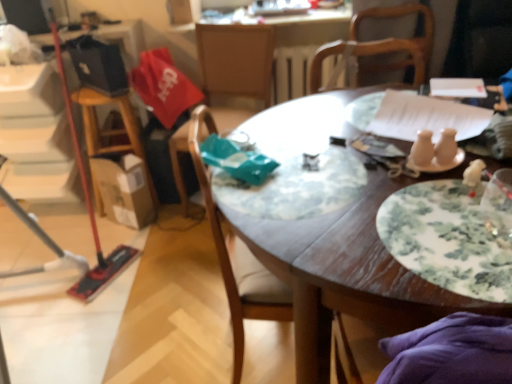
The width and height of the screenshot is (512, 384). What do you see at coordinates (447, 239) in the screenshot?
I see `floral-patterned ceramic plate at center-right` at bounding box center [447, 239].

What do you see at coordinates (234, 234) in the screenshot?
I see `wooden chair at center, the 2th chair when ordered from back to front` at bounding box center [234, 234].

What do you see at coordinates (236, 60) in the screenshot? The width and height of the screenshot is (512, 384). I see `wooden chair at center, positioned as the first chair in back-to-front order` at bounding box center [236, 60].

Image resolution: width=512 pixels, height=384 pixels. In order to click on wooden table at center in this screenshot , I will do `click(335, 272)`.

From a real-world perspective, is wooden table at center physically located above or below floral-patterned ceramic plate at center-right?

In terms of real-world spatial position, wooden table at center is below floral-patterned ceramic plate at center-right.

Between wooden table at center and floral-patterned ceramic plate at center-right, which one has more height?

wooden table at center is taller.

Is point (240, 110) closer or farther from the camera than point (294, 235)?

Clearly, point (240, 110) is more distant from the camera than point (294, 235).

From the picture: Is wooden chair at center, positioned as the first chair in back-to-front order, situated inside wooden table at center or outside?

wooden chair at center, positioned as the first chair in back-to-front order, is spatially situated outside wooden table at center.

Is wooden chair at center, positioned as the first chair in back-to-front order, bigger than wooden table at center?

Incorrect, wooden chair at center, positioned as the first chair in back-to-front order, is not larger than wooden table at center.

Between wooden chair at center, the second chair positioned from the front, and wooden table at center, which one has smaller width?

wooden chair at center, the second chair positioned from the front, is thinner.

From the image's perspective, which one is positioned higher, wooden chair at center, the second chair positioned from the front, or wooden chair at center, the 2th chair when ordered from back to front?

wooden chair at center, the second chair positioned from the front.

Find the location of a particular element. chair lying on the left of wooden chair at center, marked as the 1th chair in a front-to-back arrangement is located at coordinates (236, 60).

From a real-world perspective, does wooden chair at center, positioned as the first chair in back-to-front order, stand above wooden chair at center, marked as the 1th chair in a front-to-back arrangement?

Yes, from a real-world perspective, wooden chair at center, positioned as the first chair in back-to-front order, is over wooden chair at center, marked as the 1th chair in a front-to-back arrangement

Is wooden chair at center, the second chair positioned from the front, aimed at wooden chair at center, the 2th chair when ordered from back to front?

Yes, wooden chair at center, the second chair positioned from the front, is facing wooden chair at center, the 2th chair when ordered from back to front.

Considering the relative sizes of floral-patterned ceramic plate at center-right and wooden chair at center, positioned as the first chair in back-to-front order, in the image provided, is floral-patterned ceramic plate at center-right shorter than wooden chair at center, positioned as the first chair in back-to-front order,?

Correct, floral-patterned ceramic plate at center-right is not as tall as wooden chair at center, positioned as the first chair in back-to-front order.

Find the location of a particular element. the 2nd chair to the left of the floral-patterned ceramic plate at center-right, starting your count from the anchor is located at coordinates (236, 60).

Which point is more forward, (x=415, y=225) or (x=247, y=114)?

The point (x=415, y=225) is more forward.

Who is bigger, floral-patterned ceramic plate at center-right or wooden chair at center, positioned as the first chair in back-to-front order?

Bigger between the two is wooden chair at center, positioned as the first chair in back-to-front order.

Is wooden chair at center, the 2th chair when ordered from back to front, facing towards floral-patterned ceramic plate at center-right?

No, wooden chair at center, the 2th chair when ordered from back to front, is not turned towards floral-patterned ceramic plate at center-right.

Considering the sizes of wooden chair at center, the 2th chair when ordered from back to front, and floral-patterned ceramic plate at center-right in the image, is wooden chair at center, the 2th chair when ordered from back to front, wider or thinner than floral-patterned ceramic plate at center-right?

wooden chair at center, the 2th chair when ordered from back to front, is wider than floral-patterned ceramic plate at center-right.

This screenshot has height=384, width=512. In order to click on plate located above the wooden chair at center, marked as the 1th chair in a front-to-back arrangement (from a real-world perspective) in this screenshot , I will do `click(447, 239)`.

Based on the photo, from the image's perspective, which is below, wooden chair at center, marked as the 1th chair in a front-to-back arrangement, or floral-patterned ceramic plate at center-right?

wooden chair at center, marked as the 1th chair in a front-to-back arrangement, is shown below in the image.

Is wooden chair at center, the 2th chair when ordered from back to front, far from wooden chair at center, the second chair positioned from the front?

No, wooden chair at center, the 2th chair when ordered from back to front, is not far from wooden chair at center, the second chair positioned from the front.

In the scene shown: Is wooden chair at center, marked as the 1th chair in a front-to-back arrangement, wider than wooden chair at center, the second chair positioned from the front?

No.

What's the angular difference between wooden chair at center, marked as the 1th chair in a front-to-back arrangement, and wooden chair at center, the second chair positioned from the front,'s facing directions?

The facing directions of wooden chair at center, marked as the 1th chair in a front-to-back arrangement, and wooden chair at center, the second chair positioned from the front, are 91.4 degrees apart.

Is wooden chair at center, the 2th chair when ordered from back to front, looking in the opposite direction of wooden chair at center, the second chair positioned from the front?

No, wooden chair at center, the 2th chair when ordered from back to front,'s orientation is not away from wooden chair at center, the second chair positioned from the front.

Is wooden table at center with wooden chair at center, the 2th chair when ordered from back to front?

No.

Considering the relative sizes of wooden table at center and wooden chair at center, the 2th chair when ordered from back to front, in the image provided, is wooden table at center bigger than wooden chair at center, the 2th chair when ordered from back to front,?

Yes, wooden table at center is bigger than wooden chair at center, the 2th chair when ordered from back to front.

From the picture: Is wooden table at center oriented away from wooden chair at center, marked as the 1th chair in a front-to-back arrangement?

No, wooden table at center is not facing the opposite direction of wooden chair at center, marked as the 1th chair in a front-to-back arrangement.

From a real-world perspective, between wooden table at center and wooden chair at center, marked as the 1th chair in a front-to-back arrangement, who is vertically lower?

In real-world perspective, wooden table at center is lower.

In order to click on plate above the wooden table at center (from a real-world perspective) in this screenshot , I will do `click(447, 239)`.

From the wooden table at center, count 2nd chairs backward and point to it. Please provide its 2D coordinates.

[(236, 60)]

Looking at the image, which one is located further to wooden table at center, wooden chair at center, the second chair positioned from the front, or wooden chair at center, marked as the 1th chair in a front-to-back arrangement?

wooden chair at center, the second chair positioned from the front, is positioned further to the anchor wooden table at center.

From the image, which object appears to be nearer to wooden chair at center, the 2th chair when ordered from back to front, wooden chair at center, positioned as the first chair in back-to-front order, or floral-patterned ceramic plate at center-right?

Based on the image, floral-patterned ceramic plate at center-right appears to be nearer to wooden chair at center, the 2th chair when ordered from back to front.

Looking at the image, which one is located further to wooden table at center, floral-patterned ceramic plate at center-right or wooden chair at center, the second chair positioned from the front?

wooden chair at center, the second chair positioned from the front.

Based on their spatial positions, is wooden chair at center, positioned as the first chair in back-to-front order, or wooden chair at center, the 2th chair when ordered from back to front, further from floral-patterned ceramic plate at center-right?

wooden chair at center, positioned as the first chair in back-to-front order, is further to floral-patterned ceramic plate at center-right.

Estimate the real-world distances between objects in this image. Which object is further from floral-patterned ceramic plate at center-right, wooden chair at center, the 2th chair when ordered from back to front, or wooden table at center?

The object further to floral-patterned ceramic plate at center-right is wooden chair at center, the 2th chair when ordered from back to front.

Which object lies nearer to the anchor point wooden chair at center, the 2th chair when ordered from back to front, wooden chair at center, positioned as the first chair in back-to-front order, or wooden table at center?

Among the two, wooden table at center is located nearer to wooden chair at center, the 2th chair when ordered from back to front.

Estimate the real-world distances between objects in this image. Which object is further from wooden chair at center, the 2th chair when ordered from back to front, floral-patterned ceramic plate at center-right or wooden chair at center, the second chair positioned from the front?

Based on the image, wooden chair at center, the second chair positioned from the front, appears to be further to wooden chair at center, the 2th chair when ordered from back to front.

Considering their positions, is wooden chair at center, the 2th chair when ordered from back to front, positioned closer to wooden table at center than wooden chair at center, the second chair positioned from the front?

wooden chair at center, the 2th chair when ordered from back to front, is positioned closer to the anchor wooden table at center.

Where is `chair located between wooden table at center and wooden chair at center, positioned as the first chair in back-to-front order, in the depth direction`? The height and width of the screenshot is (384, 512). chair located between wooden table at center and wooden chair at center, positioned as the first chair in back-to-front order, in the depth direction is located at coordinates (234, 234).

Image resolution: width=512 pixels, height=384 pixels. Identify the location of plate between wooden table at center and wooden chair at center, positioned as the first chair in back-to-front order, in the front-back direction. (447, 239).

At what (x,y) coordinates should I click in order to perform the action: click on chair positioned between floral-patterned ceramic plate at center-right and wooden chair at center, positioned as the first chair in back-to-front order, from near to far. Please return your answer as a coordinate pair (x, y). Image resolution: width=512 pixels, height=384 pixels. Looking at the image, I should click on (234, 234).

This screenshot has width=512, height=384. I want to click on table situated between wooden chair at center, the 2th chair when ordered from back to front, and floral-patterned ceramic plate at center-right from left to right, so click(x=335, y=272).